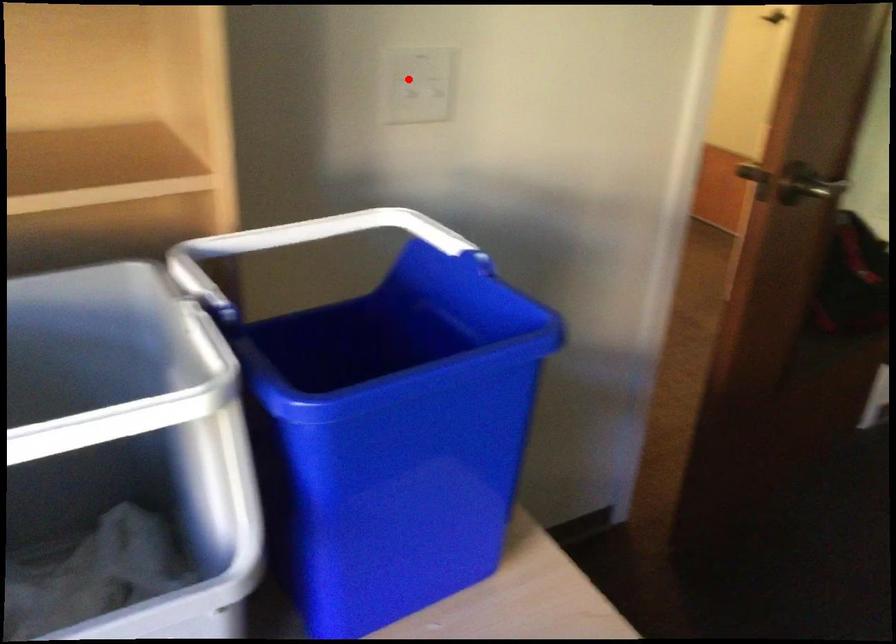
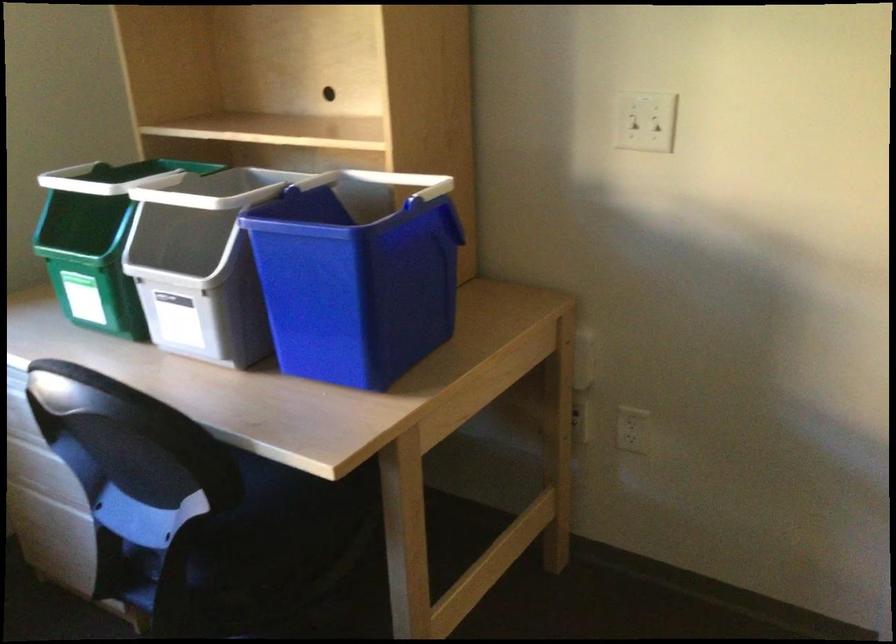
Question: I am providing you with two images of the same scene from different viewpoints. A red point is shown in image1. For the corresponding object point in image2, is it positioned nearer or farther from the camera?

Choices:
 (A) Nearer
 (B) Farther

Answer: (B)